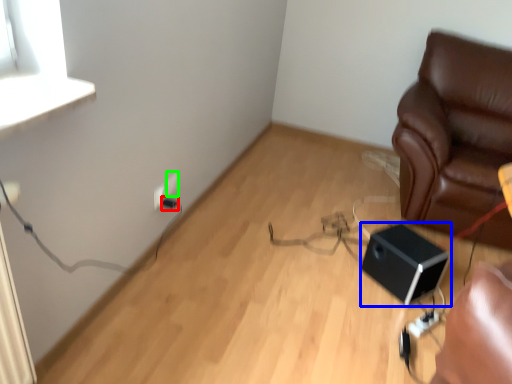
Question: Which is nearer to the electric outlet (highlighted by a red box)? speaker (highlighted by a blue box) or electric outlet (highlighted by a green box).

Choices:
 (A) speaker
 (B) electric outlet

Answer: (B)